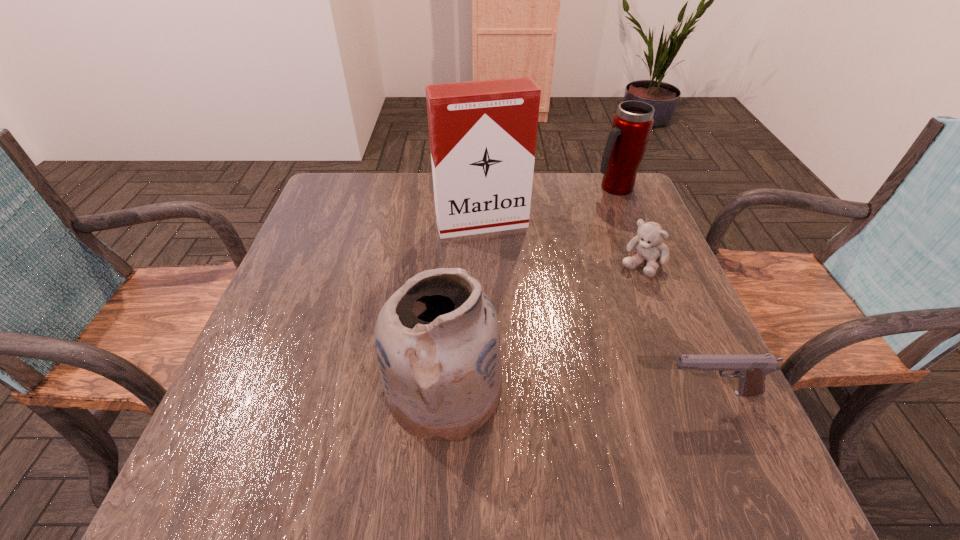
Locate an element on the screen. The width and height of the screenshot is (960, 540). free space between the teddy bear and the pottery is located at coordinates (542, 327).

Image resolution: width=960 pixels, height=540 pixels. Find the location of `free spot between the pistol and the cigarette_case`. free spot between the pistol and the cigarette_case is located at coordinates (597, 308).

At what (x,y) coordinates should I click in order to perform the action: click on free space between the teddy bear and the thermos bottle. Please return your answer as a coordinate pair (x, y). Image resolution: width=960 pixels, height=540 pixels. Looking at the image, I should click on (628, 226).

Locate an element on the screen. Image resolution: width=960 pixels, height=540 pixels. empty location between the teddy bear and the pottery is located at coordinates (542, 327).

Locate an element on the screen. blank region between the third nearest object and the tallest object is located at coordinates (562, 244).

Find the location of a particular element. The image size is (960, 540). object identified as the closest to the cigarette_case is located at coordinates (649, 245).

Select which object appears as the second closest to the pistol. Please provide its 2D coordinates. Your answer should be formatted as a tuple, i.e. [(x, y)], where the tuple contains the x and y coordinates of a point satisfying the conditions above.

[(437, 340)]

Identify the location of free spot that satisfies the following two spatial constraints: 1. on the front side of the pistol; 2. at the barrel of the teddy bear. The image size is (960, 540). (691, 393).

Locate an element on the screen. free location that satisfies the following two spatial constraints: 1. on the front side of the cigarette_case; 2. at the barrel of the pistol is located at coordinates (483, 393).